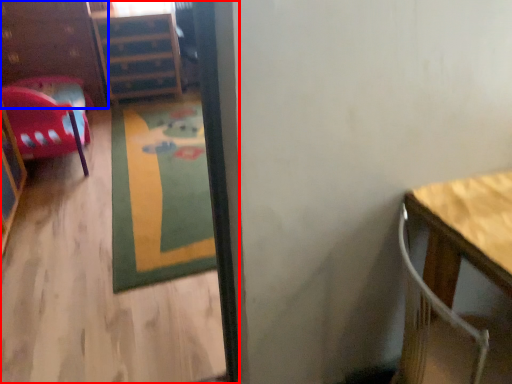
Question: Among these objects, which one is nearest to the camera, corridor (highlighted by a red box) or dresser (highlighted by a blue box)?

Choices:
 (A) corridor
 (B) dresser

Answer: (A)